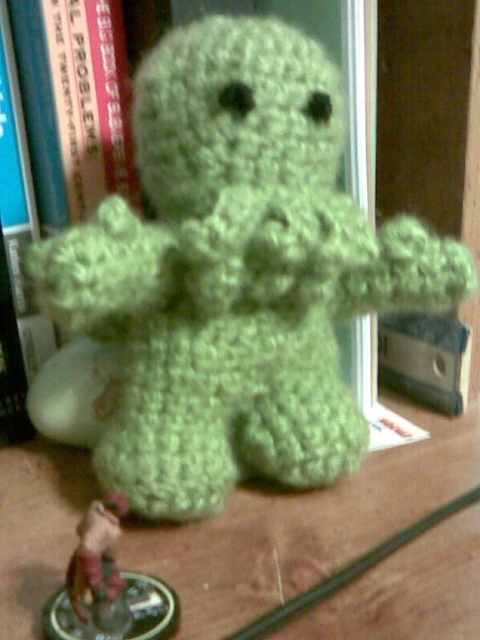
Is the position of green yarn stuffed toy at center more distant than that of metallic red figurine at lower left?

Yes.

Between point (92, 164) and point (110, 561), which one is positioned behind?

Point (92, 164)

Is point (72, 136) farther from camera compared to point (110, 632)?

Yes, point (72, 136) is behind point (110, 632).

You are a GUI agent. You are given a task and a screenshot of the screen. Output one action in this format:
    pyautogui.click(x=<x>, y=<y>)
    Task: Click on the green yarn stuffed toy at center
    This screenshot has width=480, height=640.
    Given the screenshot: What is the action you would take?
    pyautogui.click(x=74, y=104)